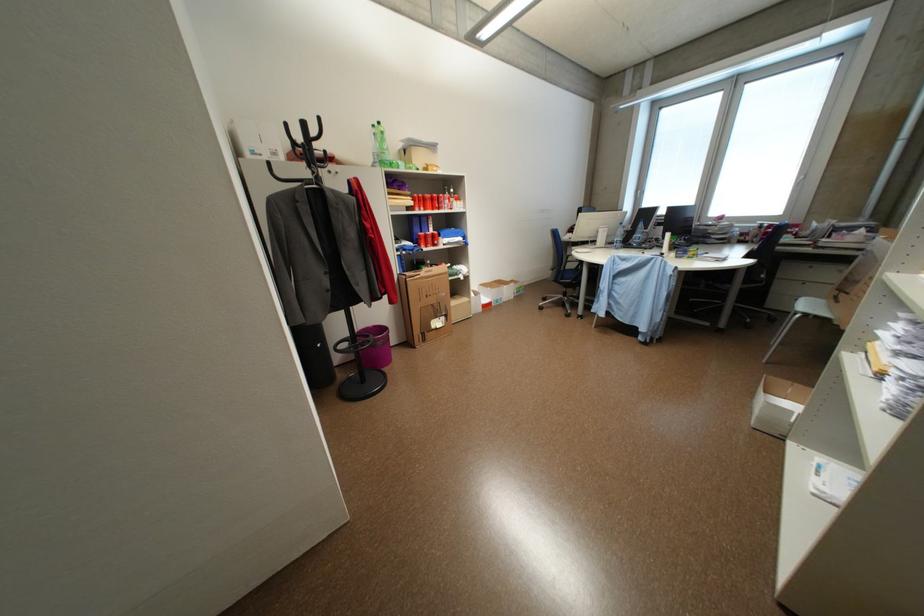
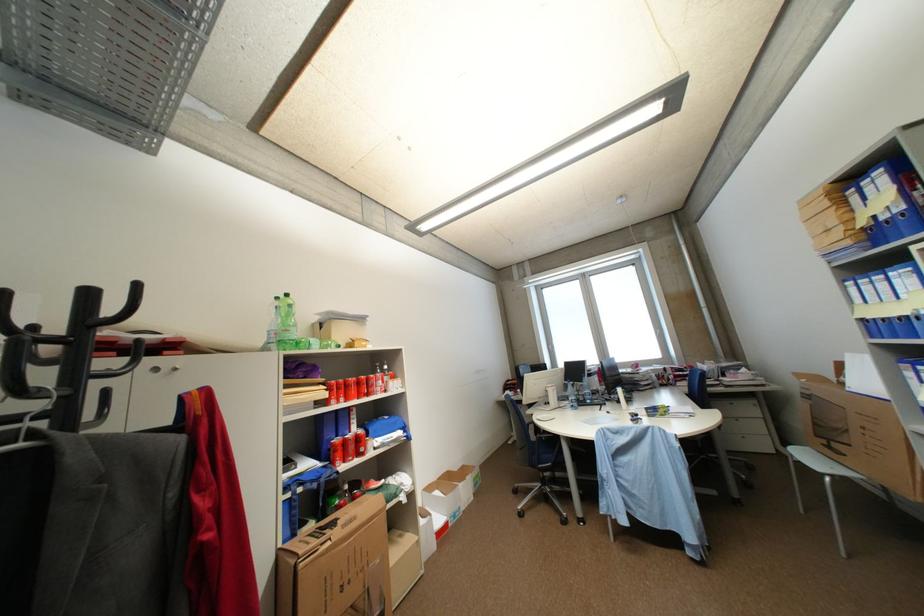
The point at (x=410, y=169) is marked in the first image. Where is the corresponding point in the second image?

(323, 349)